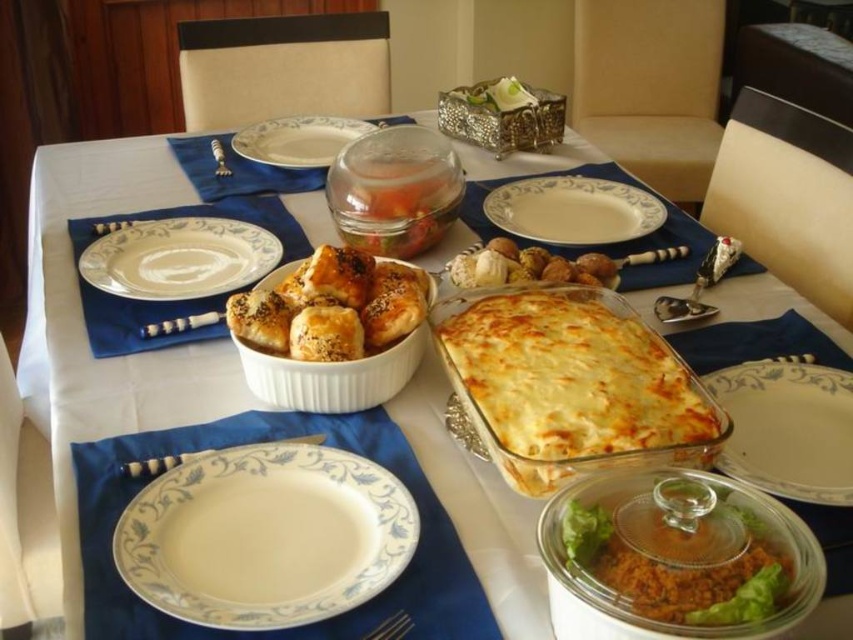
Between white glossy platter at lower left and brushed metal butter knife at upper center, which one has less height?

Standing shorter between the two is white glossy platter at lower left.

Is white glossy platter at lower left positioned behind brushed metal butter knife at upper center?

No, white glossy platter at lower left is closer to the viewer.

Between point (363, 538) and point (213, 154), which one is positioned in front?

Positioned in front is point (363, 538).

Locate an element on the screen. The height and width of the screenshot is (640, 853). white glossy platter at lower left is located at coordinates (265, 536).

Which is behind, point (741, 388) or point (393, 618)?

Point (741, 388)

Who is taller, translucent glass platter at center or silver metallic fork at lower center?

translucent glass platter at center

Who is more forward, (762, 476) or (363, 637)?

Point (363, 637)

You are a GUI agent. You are given a task and a screenshot of the screen. Output one action in this format:
    pyautogui.click(x=<x>, y=<y>)
    Task: Click on the translucent glass platter at center
    This screenshot has height=640, width=853.
    Given the screenshot: What is the action you would take?
    pyautogui.click(x=787, y=428)

Based on the photo, does white porcelain plate at center have a greater width compared to brushed metal butter knife at upper center?

Correct, the width of white porcelain plate at center exceeds that of brushed metal butter knife at upper center.

Does white porcelain plate at center appear under brushed metal butter knife at upper center?

Indeed, white porcelain plate at center is positioned under brushed metal butter knife at upper center.

Who is more forward, (642, 227) or (225, 173)?

Positioned in front is point (642, 227).

Locate an element on the screen. Image resolution: width=853 pixels, height=640 pixels. white porcelain plate at center is located at coordinates (573, 211).